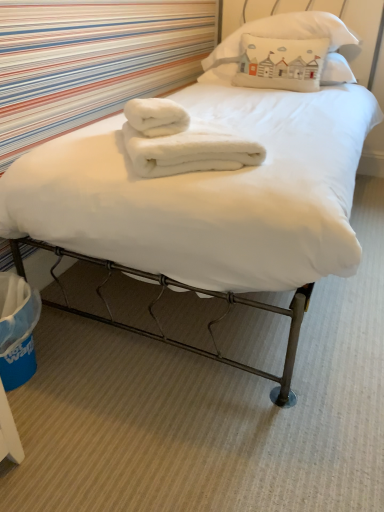
Where is `white fluffy bath towel at center, the first bath towel ordered from the bottom`? white fluffy bath towel at center, the first bath towel ordered from the bottom is located at coordinates point(180,142).

This screenshot has height=512, width=384. What do you see at coordinates (180, 142) in the screenshot?
I see `white fluffy bath towel at center, the first bath towel ordered from the bottom` at bounding box center [180, 142].

Locate an element on the screen. The height and width of the screenshot is (512, 384). white fluffy towel at center, arranged as the 1th bath towel when viewed from the top is located at coordinates (156, 116).

What do you see at coordinates (156, 116) in the screenshot?
I see `white fluffy towel at center, which appears as the second bath towel when ordered from the bottom` at bounding box center [156, 116].

This screenshot has width=384, height=512. Identify the location of white cotton pillow at upper center, which is the second pillow from top to bottom. (336, 70).

Measure the distance between white cotton pillow at upper center, which is counted as the second pillow, starting from the bottom, and camera.

white cotton pillow at upper center, which is counted as the second pillow, starting from the bottom, is 7.15 feet from camera.

Locate an element on the screen. The width and height of the screenshot is (384, 512). white cotton pillow at upper center, the first pillow viewed from the top is located at coordinates (284, 38).

Locate an element on the screen. Image resolution: width=384 pixels, height=512 pixels. white fluffy bath towel at center, the first bath towel ordered from the bottom is located at coordinates (180, 142).

In the scene shown: Would you say white cotton pillow at upper center, which ranks as the third pillow in bottom-to-top order, is a long distance from white cotton pillow at upper center, which is the second pillow from top to bottom?

That's not correct — white cotton pillow at upper center, which ranks as the third pillow in bottom-to-top order, is a little close to white cotton pillow at upper center, which is the second pillow from top to bottom.

Is white cotton pillow at upper center, the first pillow viewed from the top, not inside white cotton pillow at upper center, which is counted as the second pillow, starting from the bottom?

No, white cotton pillow at upper center, the first pillow viewed from the top, is inside or overlapping with white cotton pillow at upper center, which is counted as the second pillow, starting from the bottom.

Looking at this image, considering the sizes of white cotton pillow at upper center, the first pillow viewed from the top, and white cotton pillow at upper center, which is the second pillow from top to bottom, in the image, is white cotton pillow at upper center, the first pillow viewed from the top, wider or thinner than white cotton pillow at upper center, which is the second pillow from top to bottom,?

In the image, white cotton pillow at upper center, the first pillow viewed from the top, appears to be more narrow than white cotton pillow at upper center, which is the second pillow from top to bottom.

Does white cotton pillow at upper center, which ranks as the third pillow in bottom-to-top order, have a greater height compared to white cotton pillow at upper center, which is counted as the second pillow, starting from the bottom?

Yes.

Choose the correct answer: Is white fluffy towel at center, arranged as the 1th bath towel when viewed from the top, inside white fluffy bath towel at center, acting as the second bath towel starting from the top, or outside it?

The correct answer is: inside.

Considering the sizes of white fluffy towel at center, arranged as the 1th bath towel when viewed from the top, and white fluffy bath towel at center, acting as the second bath towel starting from the top, in the image, is white fluffy towel at center, arranged as the 1th bath towel when viewed from the top, taller or shorter than white fluffy bath towel at center, acting as the second bath towel starting from the top,?

Clearly, white fluffy towel at center, arranged as the 1th bath towel when viewed from the top, is shorter compared to white fluffy bath towel at center, acting as the second bath towel starting from the top.

Who is bigger, white fluffy towel at center, arranged as the 1th bath towel when viewed from the top, or white fluffy bath towel at center, acting as the second bath towel starting from the top?

white fluffy bath towel at center, acting as the second bath towel starting from the top.

What's the angular difference between white fluffy towel at center, which appears as the second bath towel when ordered from the bottom, and white fluffy bath towel at center, acting as the second bath towel starting from the top,'s facing directions?

1.04 degrees separate the facing orientations of white fluffy towel at center, which appears as the second bath towel when ordered from the bottom, and white fluffy bath towel at center, acting as the second bath towel starting from the top.

Considering the relative positions of white fluffy towel at center, which appears as the second bath towel when ordered from the bottom, and white cotton pillow at upper center, which is counted as the second pillow, starting from the bottom, in the image provided, is white fluffy towel at center, which appears as the second bath towel when ordered from the bottom, to the left of white cotton pillow at upper center, which is counted as the second pillow, starting from the bottom, from the viewer's perspective?

Yes, white fluffy towel at center, which appears as the second bath towel when ordered from the bottom, is to the left of white cotton pillow at upper center, which is counted as the second pillow, starting from the bottom.

From a real-world perspective, is white fluffy towel at center, arranged as the 1th bath towel when viewed from the top, below white cotton pillow at upper center, which is the second pillow from top to bottom?

Actually, white fluffy towel at center, arranged as the 1th bath towel when viewed from the top, is physically above white cotton pillow at upper center, which is the second pillow from top to bottom, in the real world.

Is white cotton pillow at upper center, which is counted as the second pillow, starting from the bottom, surrounded by white fluffy towel at center, arranged as the 1th bath towel when viewed from the top?

Definitely not — white cotton pillow at upper center, which is counted as the second pillow, starting from the bottom, is not inside white fluffy towel at center, arranged as the 1th bath towel when viewed from the top.

Between point (136, 118) and point (338, 79), which one is positioned behind?

The point (338, 79) is farther from the camera.

Which is closer, (243, 58) or (141, 109)?

Point (243, 58) appears to be farther away from the viewer than point (141, 109).

Where is `bath towel that is the 2nd object located in front of the white cotton pillow at upper center, the third pillow viewed from the top`? bath towel that is the 2nd object located in front of the white cotton pillow at upper center, the third pillow viewed from the top is located at coordinates (180, 142).

Can you tell me how much white cotton pillow at upper center, the third pillow viewed from the top, and white fluffy bath towel at center, the first bath towel ordered from the bottom, differ in facing direction?

The angular difference between white cotton pillow at upper center, the third pillow viewed from the top, and white fluffy bath towel at center, the first bath towel ordered from the bottom, is 127 degrees.

In the scene shown: Considering the relative sizes of white cotton pillow at upper center, the third pillow viewed from the top, and white fluffy bath towel at center, the first bath towel ordered from the bottom, in the image provided, is white cotton pillow at upper center, the third pillow viewed from the top, shorter than white fluffy bath towel at center, the first bath towel ordered from the bottom,?

No.

Based on the photo, can you confirm if white cotton pillow at upper center, the third pillow viewed from the top, is taller than white cotton pillow at upper center, which is the second pillow from top to bottom?

Yes, white cotton pillow at upper center, the third pillow viewed from the top, is taller than white cotton pillow at upper center, which is the second pillow from top to bottom.

Is white cotton pillow at upper center, the 1th pillow positioned from the bottom, oriented towards white cotton pillow at upper center, which is counted as the second pillow, starting from the bottom?

Yes.

From the image's perspective, relative to white cotton pillow at upper center, which is counted as the second pillow, starting from the bottom, is white cotton pillow at upper center, the 1th pillow positioned from the bottom, above or below?

white cotton pillow at upper center, the 1th pillow positioned from the bottom, is situated lower than white cotton pillow at upper center, which is counted as the second pillow, starting from the bottom, in the image.

Is white cotton pillow at upper center, the 1th pillow positioned from the bottom, to the left of white cotton pillow at upper center, which is the second pillow from top to bottom, from the viewer's perspective?

Yes, white cotton pillow at upper center, the 1th pillow positioned from the bottom, is to the left of white cotton pillow at upper center, which is the second pillow from top to bottom.

Does white cotton pillow at upper center, which ranks as the third pillow in bottom-to-top order, contain white fluffy towel at center, which appears as the second bath towel when ordered from the bottom?

No, white fluffy towel at center, which appears as the second bath towel when ordered from the bottom, is not inside white cotton pillow at upper center, which ranks as the third pillow in bottom-to-top order.

In terms of width, does white cotton pillow at upper center, which ranks as the third pillow in bottom-to-top order, look wider or thinner when compared to white fluffy towel at center, arranged as the 1th bath towel when viewed from the top?

Considering their sizes, white cotton pillow at upper center, which ranks as the third pillow in bottom-to-top order, looks broader than white fluffy towel at center, arranged as the 1th bath towel when viewed from the top.

Is white cotton pillow at upper center, the first pillow viewed from the top, taller or shorter than white fluffy towel at center, which appears as the second bath towel when ordered from the bottom?

white cotton pillow at upper center, the first pillow viewed from the top, is taller than white fluffy towel at center, which appears as the second bath towel when ordered from the bottom.

From the image's perspective, is white cotton pillow at upper center, the first pillow viewed from the top, positioned above or below white fluffy towel at center, which appears as the second bath towel when ordered from the bottom?

From the image's perspective, white cotton pillow at upper center, the first pillow viewed from the top, appears above white fluffy towel at center, which appears as the second bath towel when ordered from the bottom.

Is the position of white cotton pillow at upper center, which is counted as the second pillow, starting from the bottom, less distant than that of white fluffy bath towel at center, the first bath towel ordered from the bottom?

No, the depth of white cotton pillow at upper center, which is counted as the second pillow, starting from the bottom, is greater than that of white fluffy bath towel at center, the first bath towel ordered from the bottom.

Considering the sizes of white cotton pillow at upper center, which is counted as the second pillow, starting from the bottom, and white fluffy bath towel at center, acting as the second bath towel starting from the top, in the image, is white cotton pillow at upper center, which is counted as the second pillow, starting from the bottom, wider or thinner than white fluffy bath towel at center, acting as the second bath towel starting from the top,?

In the image, white cotton pillow at upper center, which is counted as the second pillow, starting from the bottom, appears to be wider than white fluffy bath towel at center, acting as the second bath towel starting from the top.

Who is smaller, white cotton pillow at upper center, which is the second pillow from top to bottom, or white fluffy bath towel at center, acting as the second bath towel starting from the top?

Smaller between the two is white fluffy bath towel at center, acting as the second bath towel starting from the top.

Which object is positioned more to the right, white cotton pillow at upper center, which is counted as the second pillow, starting from the bottom, or white fluffy bath towel at center, acting as the second bath towel starting from the top?

white cotton pillow at upper center, which is counted as the second pillow, starting from the bottom, is more to the right.

Which pillow is the 2nd one when counting from the back of the white cotton pillow at upper center, which ranks as the third pillow in bottom-to-top order? Please provide its 2D coordinates.

[(336, 70)]

This screenshot has width=384, height=512. Identify the location of bath towel positioned vertically above the white fluffy bath towel at center, the first bath towel ordered from the bottom (from a real-world perspective). (156, 116).

Considering their positions, is white cotton pillow at upper center, which ranks as the third pillow in bottom-to-top order, positioned further to white fluffy towel at center, which appears as the second bath towel when ordered from the bottom, than white cotton pillow at upper center, the third pillow viewed from the top?

Among the two, white cotton pillow at upper center, which ranks as the third pillow in bottom-to-top order, is located further to white fluffy towel at center, which appears as the second bath towel when ordered from the bottom.

Which object lies further to the anchor point white cotton pillow at upper center, which ranks as the third pillow in bottom-to-top order, white fluffy bath towel at center, the first bath towel ordered from the bottom, or white fluffy towel at center, which appears as the second bath towel when ordered from the bottom?

Among the two, white fluffy bath towel at center, the first bath towel ordered from the bottom, is located further to white cotton pillow at upper center, which ranks as the third pillow in bottom-to-top order.

From the image, which object appears to be nearer to white cotton pillow at upper center, which is the second pillow from top to bottom, white cotton pillow at upper center, the third pillow viewed from the top, or white fluffy towel at center, arranged as the 1th bath towel when viewed from the top?

Based on the image, white cotton pillow at upper center, the third pillow viewed from the top, appears to be nearer to white cotton pillow at upper center, which is the second pillow from top to bottom.

Estimate the real-world distances between objects in this image. Which object is further from white cotton pillow at upper center, the 1th pillow positioned from the bottom, white fluffy towel at center, which appears as the second bath towel when ordered from the bottom, or white fluffy bath towel at center, the first bath towel ordered from the bottom?

white fluffy bath towel at center, the first bath towel ordered from the bottom, is further to white cotton pillow at upper center, the 1th pillow positioned from the bottom.

Based on their spatial positions, is white cotton pillow at upper center, the 1th pillow positioned from the bottom, or white cotton pillow at upper center, which ranks as the third pillow in bottom-to-top order, further from white fluffy towel at center, which appears as the second bath towel when ordered from the bottom?

The object further to white fluffy towel at center, which appears as the second bath towel when ordered from the bottom, is white cotton pillow at upper center, which ranks as the third pillow in bottom-to-top order.

Looking at this image, considering their positions, is white fluffy bath towel at center, the first bath towel ordered from the bottom, positioned closer to white fluffy towel at center, which appears as the second bath towel when ordered from the bottom, than white cotton pillow at upper center, which ranks as the third pillow in bottom-to-top order?

white fluffy bath towel at center, the first bath towel ordered from the bottom, lies closer to white fluffy towel at center, which appears as the second bath towel when ordered from the bottom, than the other object.

Which object lies nearer to the anchor point white cotton pillow at upper center, which ranks as the third pillow in bottom-to-top order, white cotton pillow at upper center, which is counted as the second pillow, starting from the bottom, or white fluffy towel at center, which appears as the second bath towel when ordered from the bottom?

Based on the image, white cotton pillow at upper center, which is counted as the second pillow, starting from the bottom, appears to be nearer to white cotton pillow at upper center, which ranks as the third pillow in bottom-to-top order.

Which object lies nearer to the anchor point white cotton pillow at upper center, which is the second pillow from top to bottom, white cotton pillow at upper center, the 1th pillow positioned from the bottom, or white fluffy bath towel at center, acting as the second bath towel starting from the top?

Among the two, white cotton pillow at upper center, the 1th pillow positioned from the bottom, is located nearer to white cotton pillow at upper center, which is the second pillow from top to bottom.

I want to click on bath towel located between white fluffy bath towel at center, the first bath towel ordered from the bottom, and white cotton pillow at upper center, the first pillow viewed from the top, in the depth direction, so click(x=156, y=116).

Locate an element on the screen. This screenshot has height=512, width=384. pillow between white fluffy bath towel at center, the first bath towel ordered from the bottom, and white cotton pillow at upper center, the 1th pillow positioned from the bottom, along the z-axis is located at coordinates (284, 38).

Where is `pillow located between white fluffy towel at center, arranged as the 1th bath towel when viewed from the top, and white cotton pillow at upper center, the third pillow viewed from the top, in the depth direction`? The height and width of the screenshot is (512, 384). pillow located between white fluffy towel at center, arranged as the 1th bath towel when viewed from the top, and white cotton pillow at upper center, the third pillow viewed from the top, in the depth direction is located at coordinates (284, 38).

The width and height of the screenshot is (384, 512). Identify the location of bath towel between white fluffy bath towel at center, acting as the second bath towel starting from the top, and white cotton pillow at upper center, the 1th pillow positioned from the bottom, in the front-back direction. (156, 116).